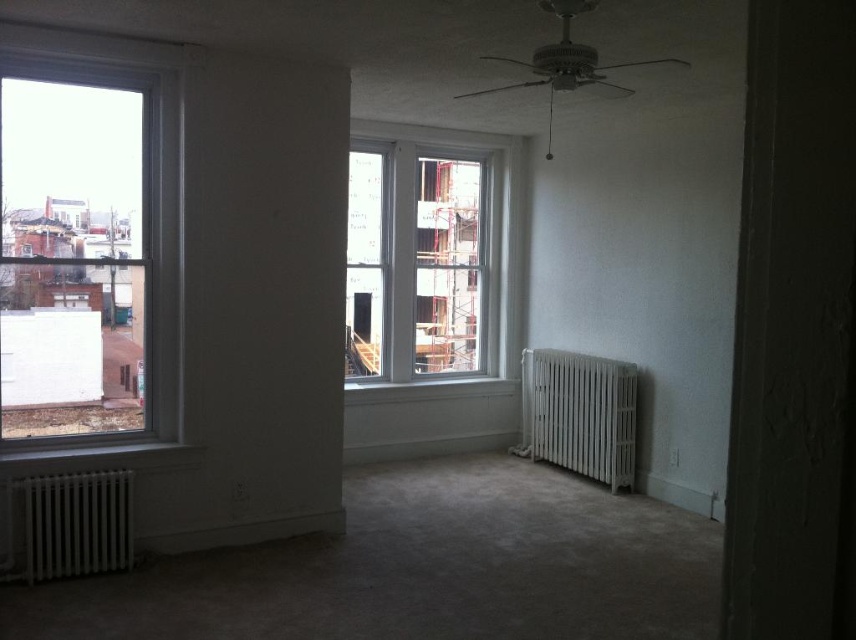
Does clear glass window at left lie behind white matte radiator at lower left?

No, clear glass window at left is closer to the viewer.

The image size is (856, 640). What do you see at coordinates (86, 244) in the screenshot? I see `clear glass window at left` at bounding box center [86, 244].

Image resolution: width=856 pixels, height=640 pixels. Describe the element at coordinates (86, 244) in the screenshot. I see `clear glass window at left` at that location.

Image resolution: width=856 pixels, height=640 pixels. Find the location of `clear glass window at left`. clear glass window at left is located at coordinates coord(86,244).

Which is above, white wooden window at center or white matte radiator at lower left?

white wooden window at center is higher up.

Is point (516, 228) closer to camera compared to point (100, 483)?

No, (516, 228) is further to viewer.

At what (x,y) coordinates should I click in order to perform the action: click on white wooden window at center. Please return your answer as a coordinate pair (x, y). This screenshot has width=856, height=640. Looking at the image, I should click on (431, 252).

The image size is (856, 640). I want to click on white matte radiator at lower right, so click(580, 413).

This screenshot has width=856, height=640. Find the location of `white matte radiator at lower right`. white matte radiator at lower right is located at coordinates (580, 413).